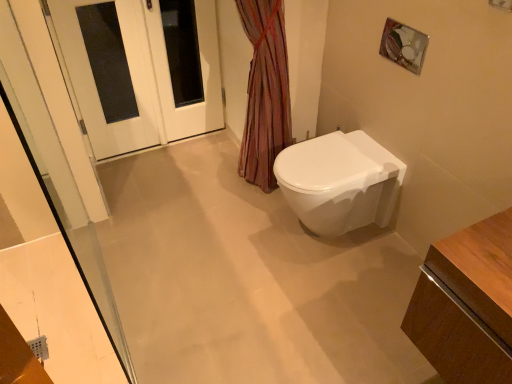
Question: Considering their positions, is white glossy toilet at center-right located in front of or behind white glossy door at upper left?

Choices:
 (A) front
 (B) behind

Answer: (A)

Question: From the image's perspective, is white glossy toilet at center-right located above or below white glossy door at upper left?

Choices:
 (A) above
 (B) below

Answer: (B)

Question: Which of these objects is positioned farthest from the white glossy door at upper left?

Choices:
 (A) white glossy door at upper left
 (B) white glossy toilet at center-right

Answer: (B)

Question: Which of these objects is positioned closest to the white glossy door at upper left?

Choices:
 (A) white glossy toilet at center-right
 (B) white glossy door at upper left

Answer: (B)